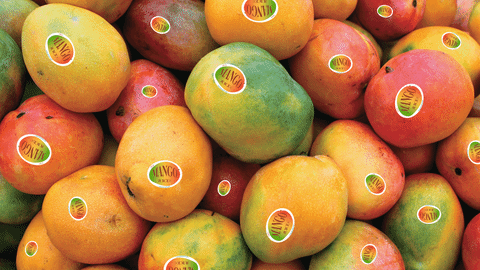
Identify the location of sticker label. click(x=270, y=228), click(x=164, y=181), click(x=78, y=204), click(x=65, y=50).